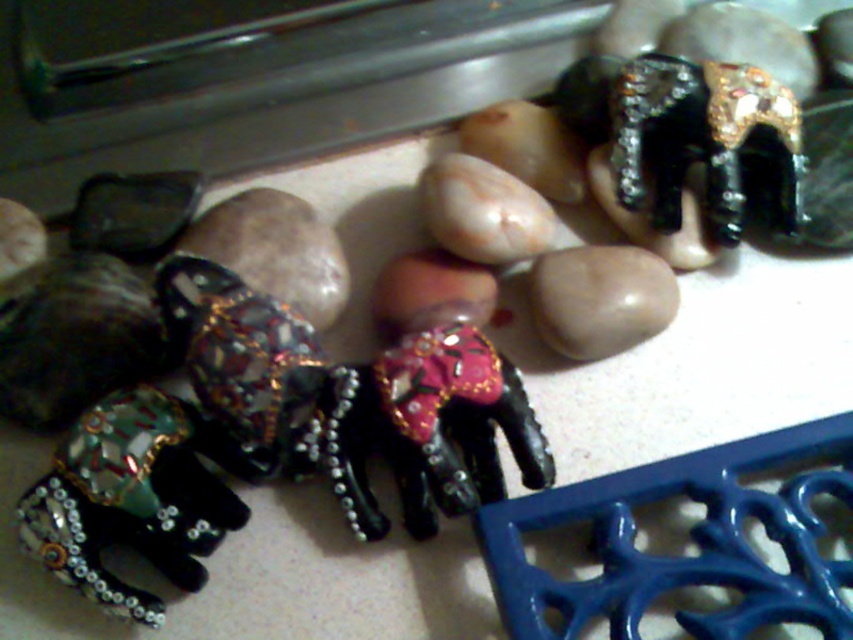
Who is taller, metallic beaded elephant at lower left or smooth beige rock at center?

metallic beaded elephant at lower left is taller.

Does metallic beaded elephant at lower left have a smaller size compared to smooth beige rock at center?

Incorrect, metallic beaded elephant at lower left is not smaller in size than smooth beige rock at center.

Is point (192, 456) positioned behind point (639, 340)?

No, it is in front of (639, 340).

Locate an element on the screen. The image size is (853, 640). metallic beaded elephant at lower left is located at coordinates (131, 499).

Is black glossy elephant at center to the right of smooth beige rock at center from the viewer's perspective?

Incorrect, black glossy elephant at center is not on the right side of smooth beige rock at center.

Which is more to the right, black glossy elephant at center or smooth beige rock at center?

smooth beige rock at center is more to the right.

Between point (399, 298) and point (550, 300), which one is positioned behind?

Positioned behind is point (399, 298).

Find the location of a particular element. The height and width of the screenshot is (640, 853). black glossy elephant at center is located at coordinates (451, 380).

Is metallic beaded elephant at lower left below black glossy elephant at center?

Yes, metallic beaded elephant at lower left is below black glossy elephant at center.

Who is positioned more to the left, metallic beaded elephant at lower left or black glossy elephant at center?

Positioned to the left is metallic beaded elephant at lower left.

At what (x,y) coordinates should I click in order to perform the action: click on metallic beaded elephant at lower left. Please return your answer as a coordinate pair (x, y). This screenshot has height=640, width=853. Looking at the image, I should click on (131, 499).